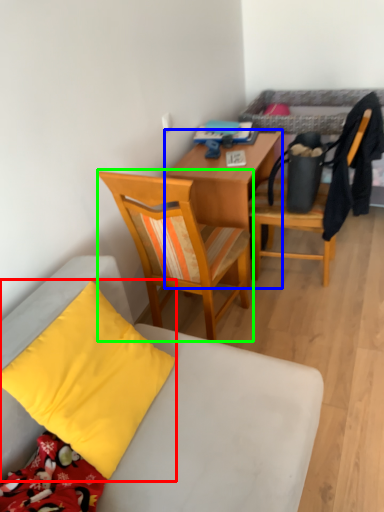
Question: Considering the real-world distances, which object is farthest from pillow (highlighted by a red box)? desk (highlighted by a blue box) or chair (highlighted by a green box)?

Choices:
 (A) desk
 (B) chair

Answer: (A)